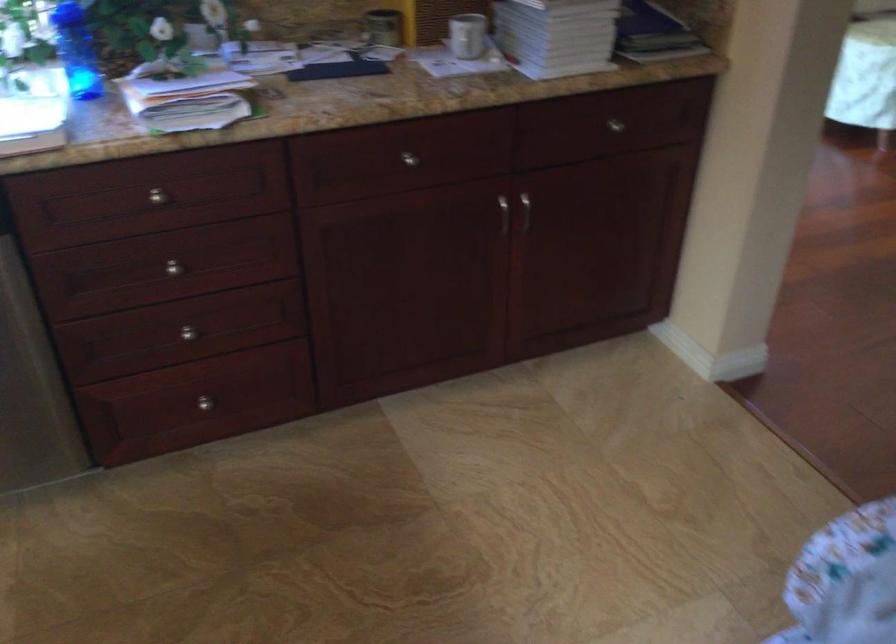
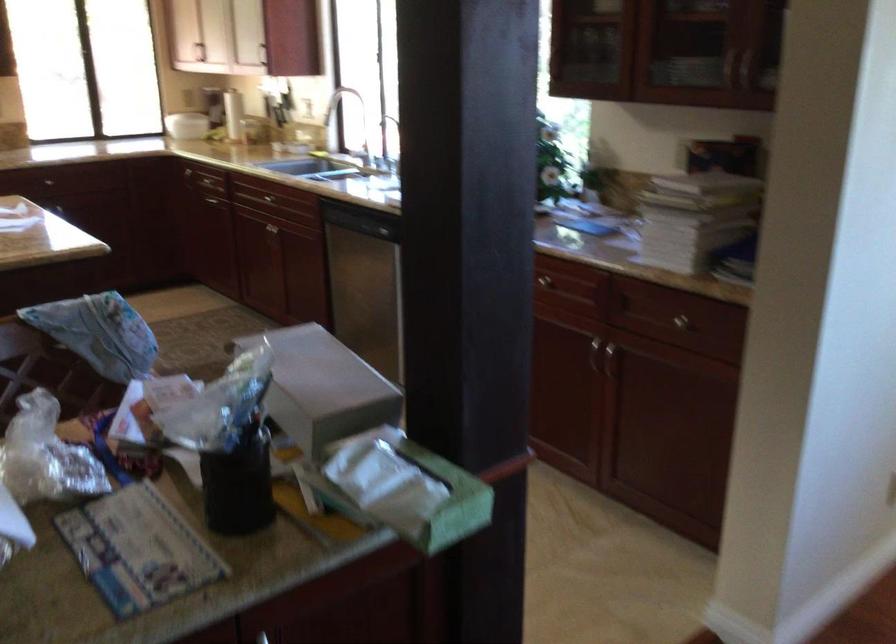
Question: I am providing you with two images of the same scene from different viewpoints. After the viewpoint changes to image2, which objects are now occluded?

Choices:
 (A) shower curtain hook
 (B) drawer knob
 (C) dishwasher handle
 (D) metal cabinet handle

Answer: (B)